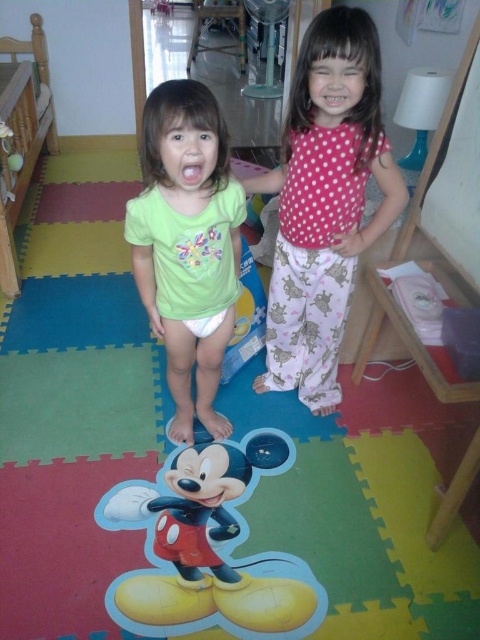
Question: Which object is farther from the camera taking this photo?

Choices:
 (A) pink dotted pajamas at center
 (B) wooden bed at left

Answer: (B)

Question: Is pink dotted pajamas at center below green matte shirt at center?

Choices:
 (A) no
 (B) yes

Answer: (A)

Question: Which object is closer to the camera taking this photo?

Choices:
 (A) pink dotted pajamas at center
 (B) wooden bed at left
 (C) shiny plastic mickey mouse at center

Answer: (A)

Question: Is pink dotted pajamas at center further to camera compared to green matte shirt at center?

Choices:
 (A) yes
 (B) no

Answer: (A)

Question: Considering the real-world distances, which object is closest to the shiny plastic mickey mouse at center?

Choices:
 (A) pink dotted pajamas at center
 (B) wooden bed at left
 (C) green matte shirt at center

Answer: (C)

Question: Can you confirm if green matte shirt at center is smaller than shiny plastic mickey mouse at center?

Choices:
 (A) yes
 (B) no

Answer: (B)